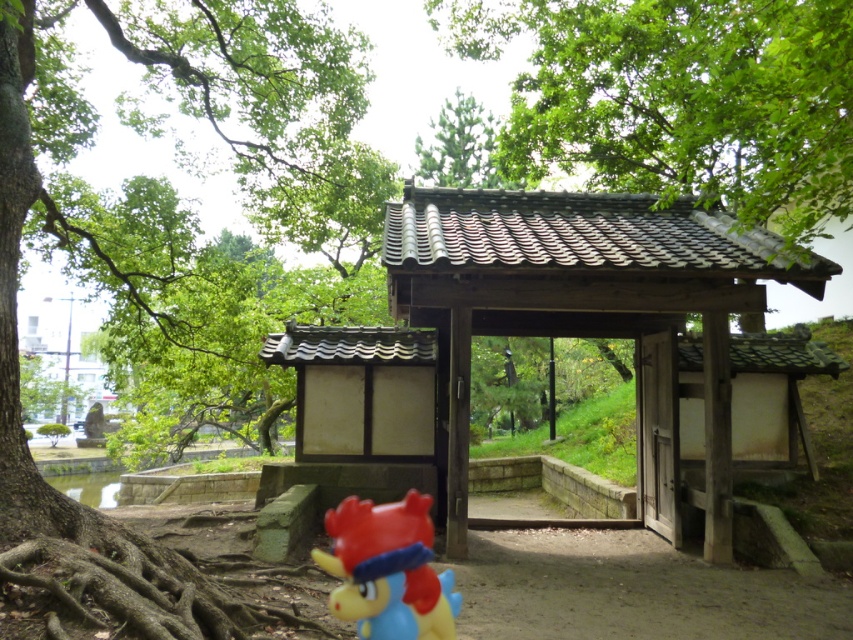
Question: Is green leafy tree at upper center thinner than green leafy tree at left?

Choices:
 (A) no
 (B) yes

Answer: (A)

Question: Is the position of green leafy tree at left less distant than that of rubberized red plush toy at lower center?

Choices:
 (A) no
 (B) yes

Answer: (A)

Question: Which point is closer to the camera?

Choices:
 (A) wooden gate at center
 (B) rubberized red plush toy at lower center
 (C) green matte tree at upper center
 (D) green leafy tree at left

Answer: (B)

Question: Which object is farther from the camera taking this photo?

Choices:
 (A) green leafy tree at upper center
 (B) green leafy tree at left

Answer: (A)

Question: Which object is farther from the camera taking this photo?

Choices:
 (A) rubberized red plush toy at lower center
 (B) green leafy tree at upper center

Answer: (B)

Question: Does wooden gate at center come in front of rubberized red plush toy at lower center?

Choices:
 (A) no
 (B) yes

Answer: (A)